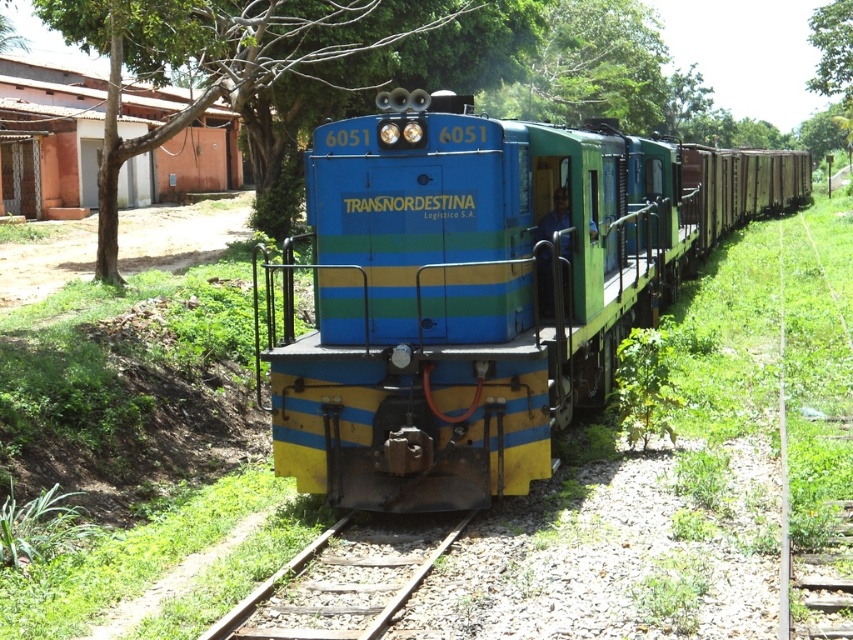
Question: Which point is closer to the camera?

Choices:
 (A) tap(440, 460)
 (B) tap(253, 598)

Answer: (B)

Question: Which of the following is the farthest from the observer?

Choices:
 (A) (x=467, y=401)
 (B) (x=346, y=28)

Answer: (B)

Question: In this image, where is green leafy tree at center located relative to rusty metal train track at center?

Choices:
 (A) left
 (B) right

Answer: (A)

Question: Considering the real-world distances, which object is closest to the blue glossy train at center?

Choices:
 (A) rusty metal train track at center
 (B) green leafy tree at center

Answer: (B)

Question: Is blue glossy train at center closer to camera compared to green leafy tree at center?

Choices:
 (A) no
 (B) yes

Answer: (B)

Question: Is green leafy tree at center bigger than rusty metal train track at center?

Choices:
 (A) no
 (B) yes

Answer: (B)